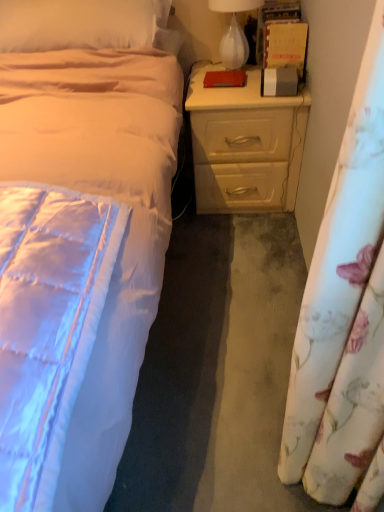
Question: From the image's perspective, is floral fabric curtain at right located beneath beige wood nightstand at right?

Choices:
 (A) no
 (B) yes

Answer: (B)

Question: From a real-world perspective, is floral fabric curtain at right under beige wood nightstand at right?

Choices:
 (A) no
 (B) yes

Answer: (A)

Question: Can you confirm if floral fabric curtain at right is positioned to the left of beige wood nightstand at right?

Choices:
 (A) no
 (B) yes

Answer: (A)

Question: Is floral fabric curtain at right positioned far away from beige wood nightstand at right?

Choices:
 (A) no
 (B) yes

Answer: (B)

Question: Can you confirm if floral fabric curtain at right is positioned to the right of beige wood nightstand at right?

Choices:
 (A) yes
 (B) no

Answer: (A)

Question: From the image's perspective, is white glass lamp at upper right positioned above or below beige satin pillow at upper left?

Choices:
 (A) above
 (B) below

Answer: (A)

Question: From a real-world perspective, is white glass lamp at upper right physically located above or below beige satin pillow at upper left?

Choices:
 (A) below
 (B) above

Answer: (A)

Question: Visually, is white glass lamp at upper right positioned to the left or to the right of beige satin pillow at upper left?

Choices:
 (A) left
 (B) right

Answer: (B)

Question: Considering the positions of white glass lamp at upper right and beige satin pillow at upper left in the image, is white glass lamp at upper right wider or thinner than beige satin pillow at upper left?

Choices:
 (A) thin
 (B) wide

Answer: (A)

Question: In terms of size, does beige satin pillow at upper left appear bigger or smaller than white glass lamp at upper right?

Choices:
 (A) small
 (B) big

Answer: (B)

Question: From the image's perspective, is beige satin pillow at upper left located above or below white glass lamp at upper right?

Choices:
 (A) below
 (B) above

Answer: (A)

Question: Choose the correct answer: Is beige satin pillow at upper left inside white glass lamp at upper right or outside it?

Choices:
 (A) outside
 (B) inside

Answer: (A)

Question: From a real-world perspective, relative to white glass lamp at upper right, is beige satin pillow at upper left vertically above or below?

Choices:
 (A) below
 (B) above

Answer: (B)

Question: Is floral fabric curtain at right taller or shorter than white glass lamp at upper right?

Choices:
 (A) tall
 (B) short

Answer: (A)

Question: Is floral fabric curtain at right to the left or to the right of white glass lamp at upper right in the image?

Choices:
 (A) left
 (B) right

Answer: (B)